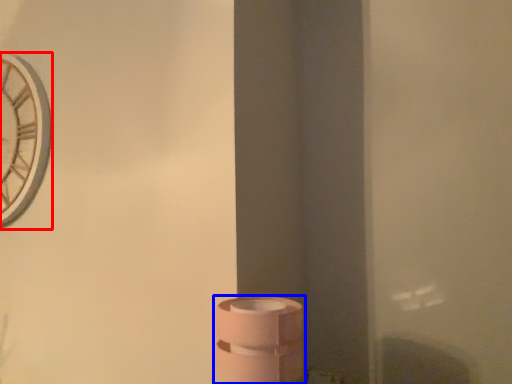
Question: Which object is closer to the camera taking this photo, clock (highlighted by a red box) or toilet paper (highlighted by a blue box)?

Choices:
 (A) clock
 (B) toilet paper

Answer: (B)